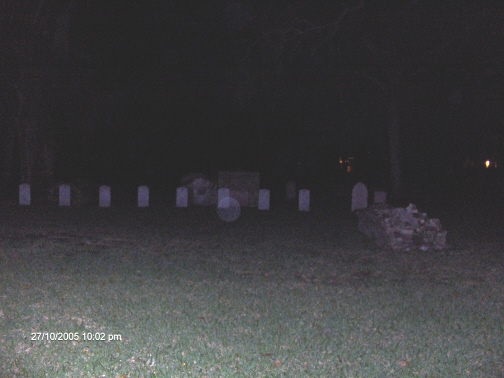
Find the location of a particular element. This screenshot has width=504, height=378. light is located at coordinates (487, 166).